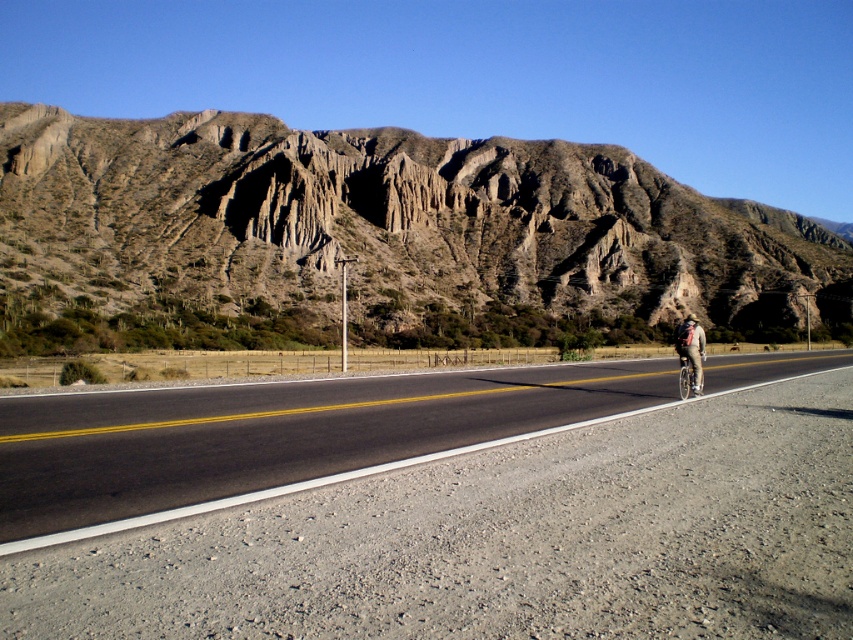
You are a drone operator planning to capture aerial footage of the black asphalt road at center. The camera is mounted at a fixed height of 10 meters above the ground. To ensure the road is centered in the frame, where should you position the drone relative to the road? Please provide coordinates based on the image coordinate system where the bottom left corner is the origin point.

The black asphalt road at center is located at coordinates point (277,435), so you should position the drone directly above that point to center the road in the frame.

You are a delivery driver planning to drive a truck that is 2.5 meters wide along the black asphalt road at center. Given that the light brown fabric jacket at right is 3 meters wide, can your truck safely pass through the road without hitting the jacket?

The black asphalt road at center has a width less than the light brown fabric jacket at right, which is 3 meters wide. Since the truck is 2.5 meters wide, it can safely pass as the road is narrower than the jacket, but the jacket is wider than the truck. Wait, this seems contradictory. Let me recalculate. If the road is narrower than the jacket, and the jacket is 3m wide, the road must be less than 3m. The truck is 2.5m, so if the road is at least 2.5m, it can pass. But since the jacket is wider than the ro

You are a hiker standing at the cyclist position. You want to reach the rugged brown rock formation at upper center. Which direction should you walk to get there?

The rugged brown rock formation at upper center is located at point [376,240], so you should walk towards the upper center direction to reach it.